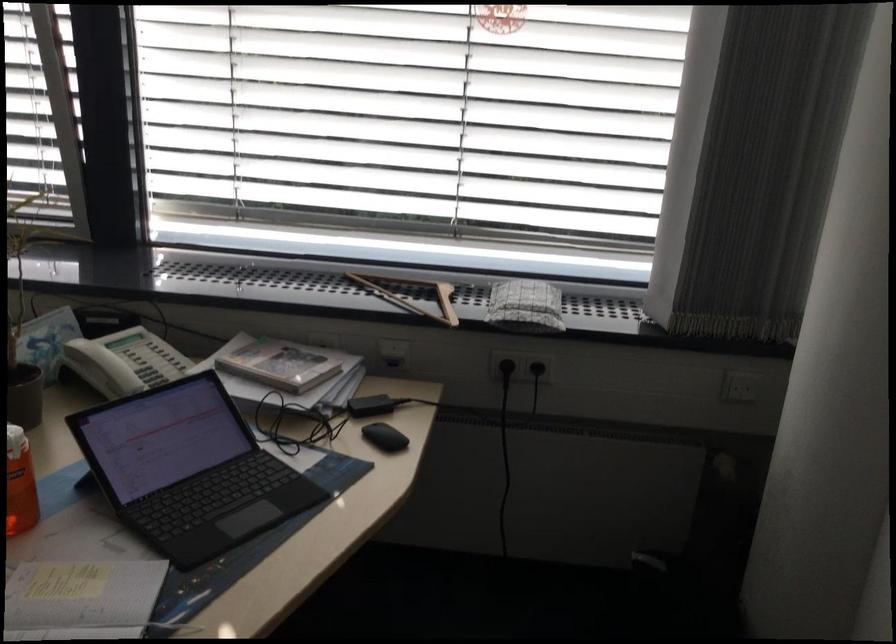
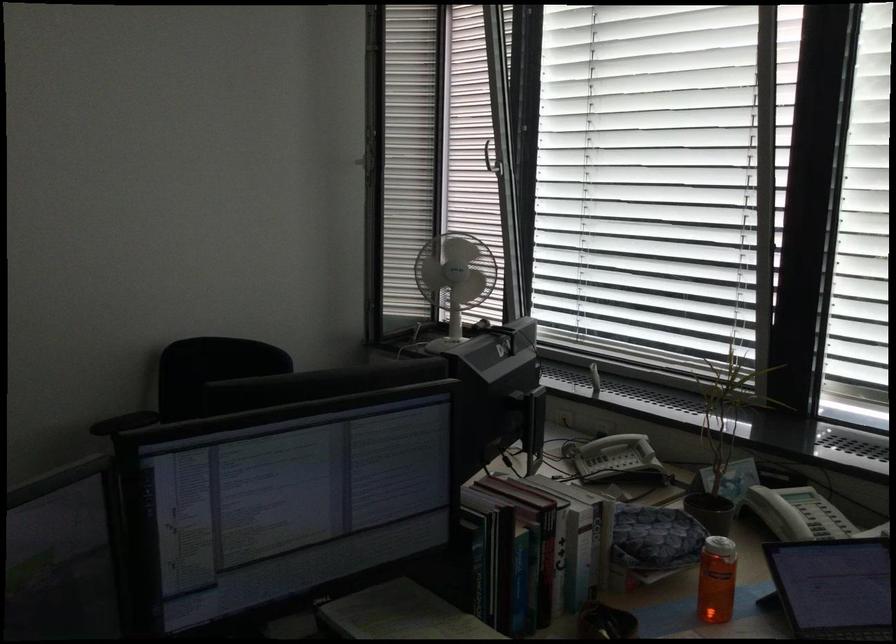
Question: Based on the continuous images, in which direction is the camera rotating? Reply with the corresponding letter.

Choices:
 (A) Left
 (B) Right
 (C) Up
 (D) Down

Answer: (A)